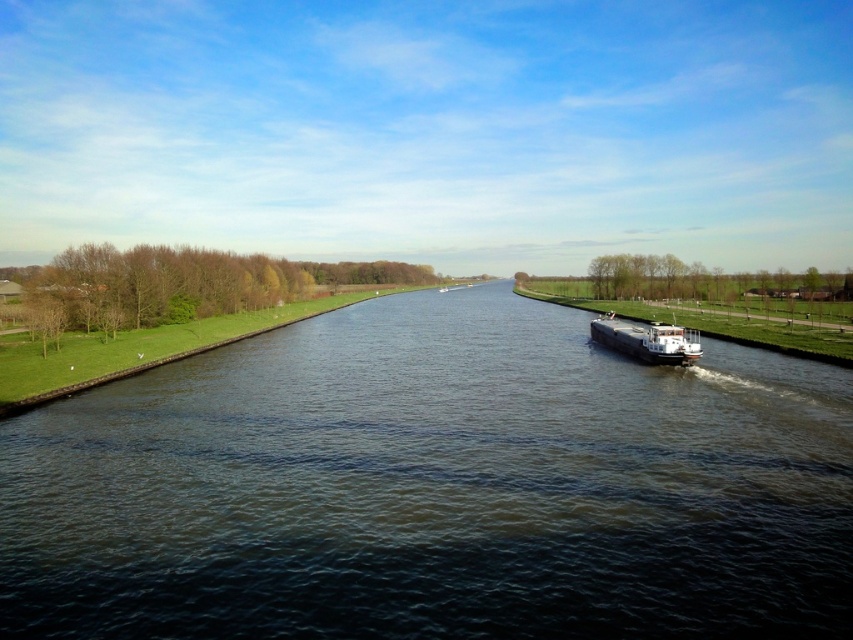
You are a photographer positioned on the left bank of the canal. You want to capture a photo of the white glossy barge at center and the dark blue water at center in the same frame. Based on their positions, which object should appear closer to the left edge of your photo?

The dark blue water at center is to the left of the white glossy barge at center, so in the photo, the dark blue water at center will appear closer to the left edge.

You are standing at the edge of the canal and want to know the exact location of the dark blue water at center. What are the coordinates where it is positioned?

The dark blue water at center is positioned at coordinates point (x=434, y=486).